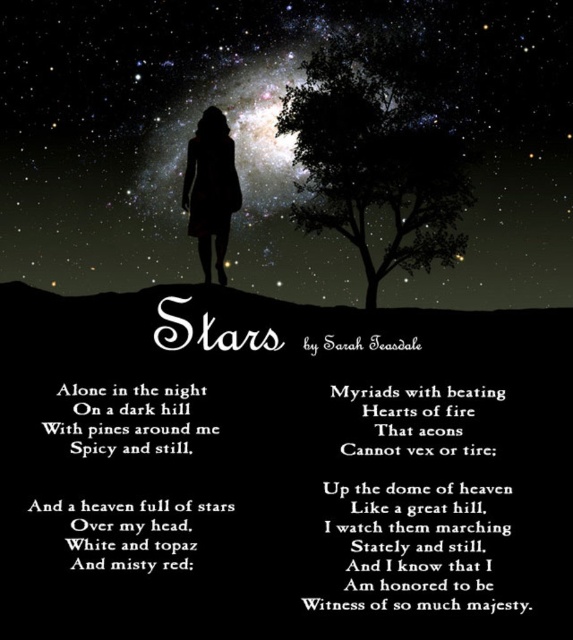
Question: Among these objects, which one is nearest to the camera?

Choices:
 (A) green leafy tree at upper center
 (B) matte black dress at center

Answer: (B)

Question: Among these points, which one is farthest from the camera?

Choices:
 (A) (202, 172)
 (B) (329, 42)

Answer: (B)

Question: Does green leafy tree at upper center appear on the right side of matte black dress at center?

Choices:
 (A) yes
 (B) no

Answer: (A)

Question: Can you confirm if green leafy tree at upper center is wider than matte black dress at center?

Choices:
 (A) yes
 (B) no

Answer: (A)

Question: Does green leafy tree at upper center appear under matte black dress at center?

Choices:
 (A) yes
 (B) no

Answer: (B)